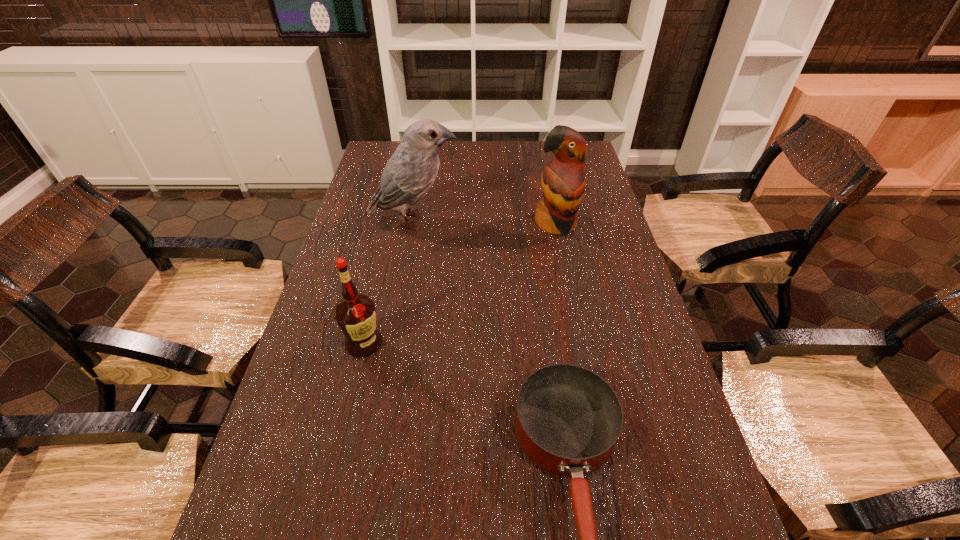
The width and height of the screenshot is (960, 540). I want to click on free space at the far edge of the desktop, so click(479, 167).

Identify the location of free spot at the left edge of the desktop. (332, 496).

The image size is (960, 540). I want to click on blank space at the right edge of the desktop, so click(x=644, y=369).

I want to click on free space between the left parrot and the second shortest object, so click(389, 282).

At what (x,y) coordinates should I click in order to perform the action: click on free space between the left parrot and the alcohol. Please return your answer as a coordinate pair (x, y). Looking at the image, I should click on (389, 282).

Where is `empty space between the left parrot and the alcohol`? empty space between the left parrot and the alcohol is located at coordinates (389, 282).

Find the location of a particular element. Image resolution: width=960 pixels, height=540 pixels. unoccupied position between the second nearest object and the right parrot is located at coordinates (460, 284).

At what (x,y) coordinates should I click in order to perform the action: click on vacant space that is in between the left parrot and the right parrot. Please return your answer as a coordinate pair (x, y). Looking at the image, I should click on (485, 222).

The height and width of the screenshot is (540, 960). I want to click on vacant point located between the left parrot and the right parrot, so click(x=485, y=222).

At what (x,y) coordinates should I click in order to perform the action: click on object that is the second closest to the left parrot. Please return your answer as a coordinate pair (x, y). The image size is (960, 540). Looking at the image, I should click on (355, 314).